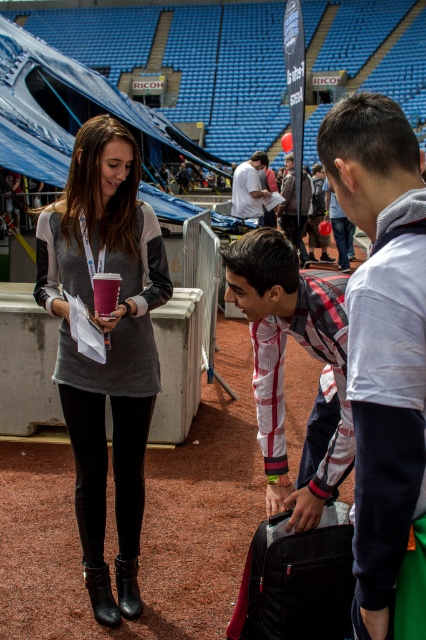
Who is shorter, dark gray hoodie at right or white cotton shirt at center?

white cotton shirt at center

Does point (406, 529) come closer to viewer compared to point (259, 195)?

Yes, point (406, 529) is closer to viewer.

Locate an element on the screen. dark gray hoodie at right is located at coordinates (385, 356).

Which is in front, point (120, 518) or point (305, 602)?

Positioned in front is point (305, 602).

Does point (137, 224) lie in front of point (342, 524)?

No.

Who is more distant from viewer, (60,387) or (259,532)?

Positioned behind is point (60,387).

Locate an element on the screen. This screenshot has width=426, height=640. gray matte sweater at center is located at coordinates (106, 348).

Who is positioned more to the right, dark gray hoodie at right or black fabric suitcase at lower right?

dark gray hoodie at right is more to the right.

Consider the image. Does dark gray hoodie at right appear on the right side of black fabric suitcase at lower right?

Yes, dark gray hoodie at right is to the right of black fabric suitcase at lower right.

Does point (393, 109) lie in front of point (302, 602)?

Yes, point (393, 109) is closer to viewer.

Where is `dark gray hoodie at right`? The height and width of the screenshot is (640, 426). dark gray hoodie at right is located at coordinates (385, 356).